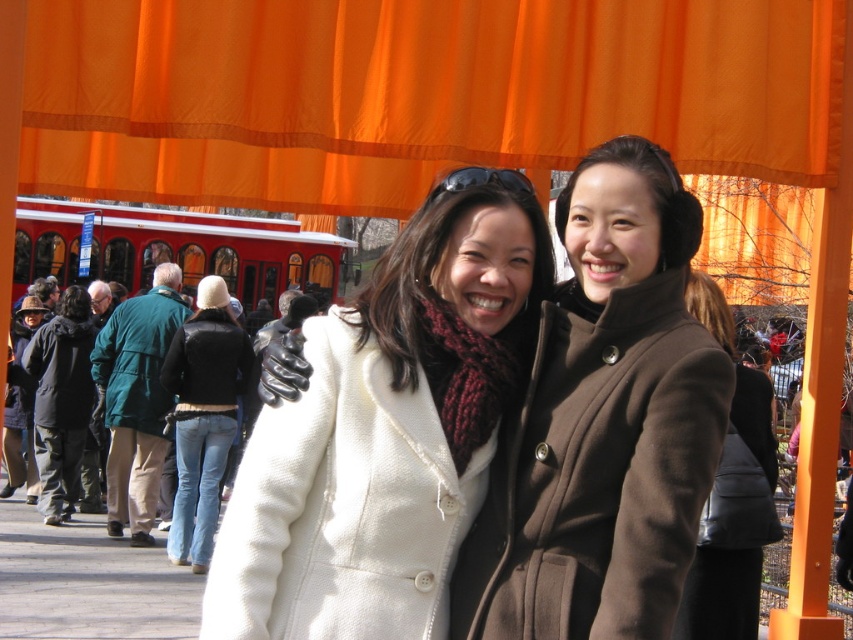
Question: Which of the following is the farthest from the observer?

Choices:
 (A) (579, 484)
 (B) (223, 364)
 (C) (225, 602)
 (D) (65, 401)

Answer: (D)

Question: Among these objects, which one is farthest from the camera?

Choices:
 (A) white woolen coat at center
 (B) black fuzzy coat at center
 (C) brown woolen coat at center

Answer: (B)

Question: Does white woolen coat at center lie behind black leather jacket at center?

Choices:
 (A) no
 (B) yes

Answer: (A)

Question: Does white woolen coat at center have a greater width compared to black leather jacket at center?

Choices:
 (A) no
 (B) yes

Answer: (B)

Question: Among these points, which one is nearest to the camera?

Choices:
 (A) (376, 456)
 (B) (270, 72)
 (C) (172, 362)

Answer: (A)

Question: From the image, what is the correct spatial relationship of brown wool coat at center in relation to dark gray wool coat at left?

Choices:
 (A) below
 (B) above

Answer: (A)